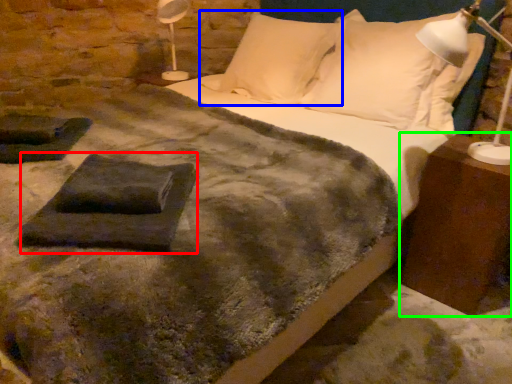
Question: Considering the real-world distances, which object is closest to slate (highlighted by a red box)? pillow (highlighted by a blue box) or nightstand (highlighted by a green box).

Choices:
 (A) pillow
 (B) nightstand

Answer: (B)